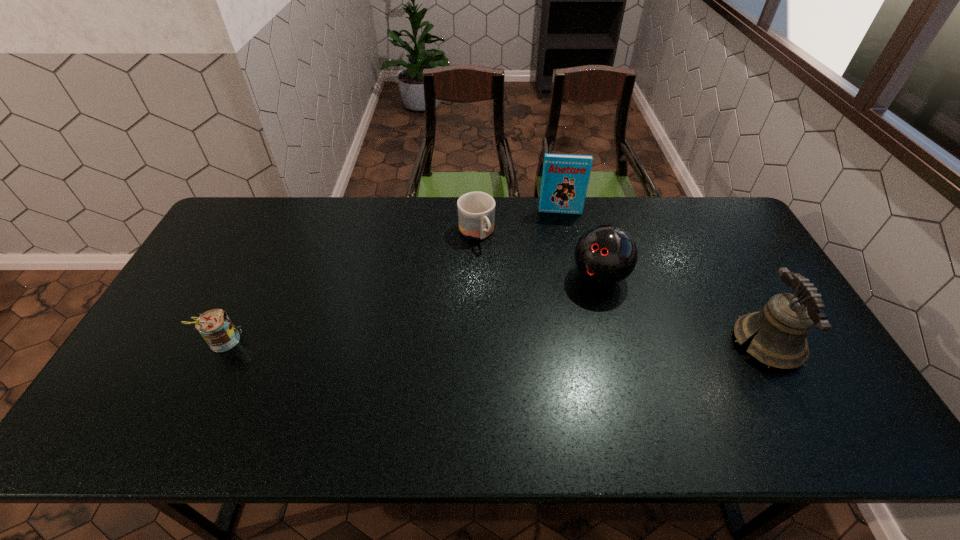
Choose which object is the third nearest neighbor to the book. Please provide its 2D coordinates. Your answer should be formatted as a tuple, i.e. [(x, y)], where the tuple contains the x and y coordinates of a point satisfying the conditions above.

[(781, 327)]

Locate an element on the screen. Image resolution: width=960 pixels, height=540 pixels. the third closest object to the book is located at coordinates (781, 327).

I want to click on vacant region that satisfies the following two spatial constraints: 1. on the front side of the third shortest object; 2. on the left side of the bell, so click(617, 344).

You are a GUI agent. You are given a task and a screenshot of the screen. Output one action in this format:
    pyautogui.click(x=<x>, y=<y>)
    Task: Click on the free spot that satisfies the following two spatial constraints: 1. on the front side of the book; 2. on the right side of the rightmost object
    The width and height of the screenshot is (960, 540).
    Given the screenshot: What is the action you would take?
    pyautogui.click(x=588, y=344)

At what (x,y) coordinates should I click in order to perform the action: click on vacant space that satisfies the following two spatial constraints: 1. on the front side of the third shortest object; 2. on the left side of the bell. Please return your answer as a coordinate pair (x, y). This screenshot has width=960, height=540. Looking at the image, I should click on (617, 344).